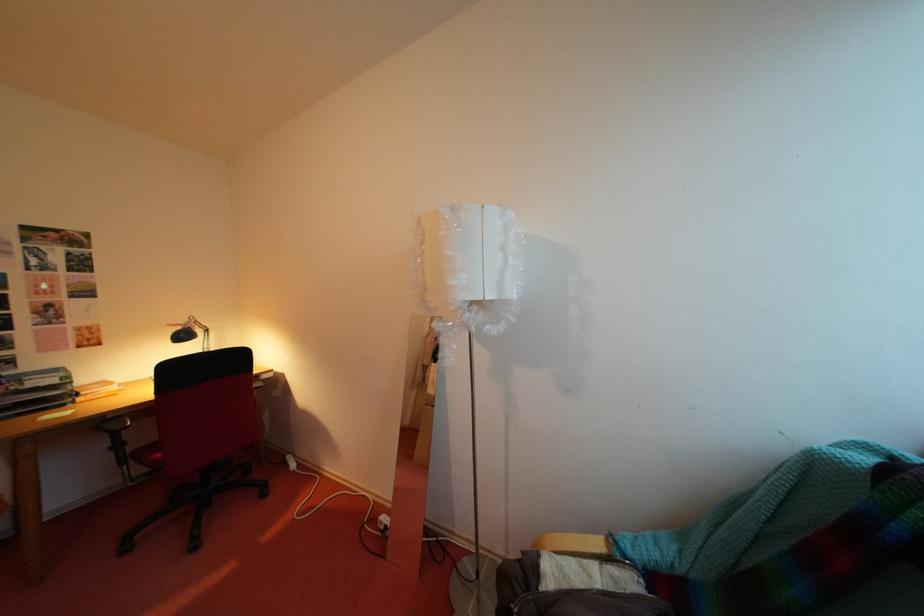
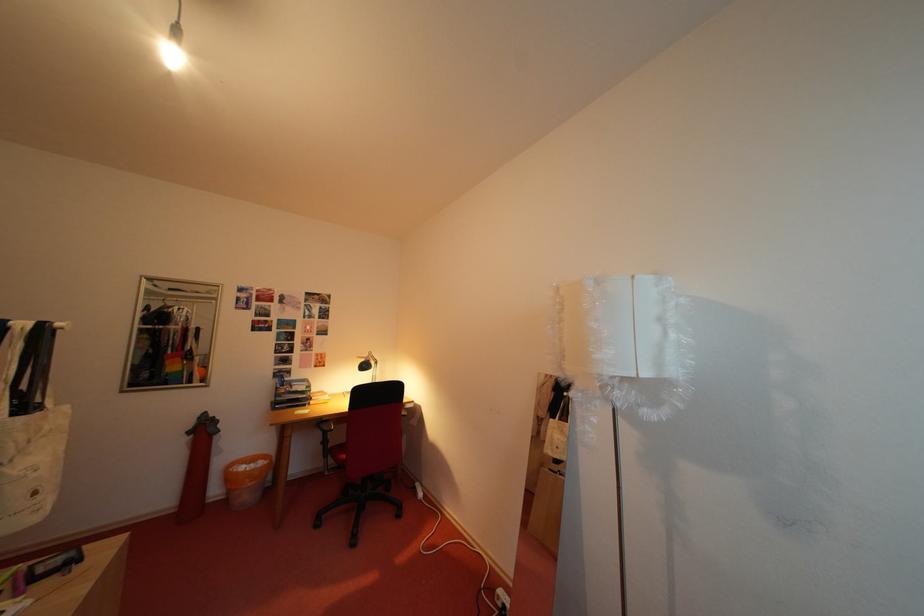
In the scene shown: The images are taken continuously from a first-person perspective. In which direction are you moving?

The cameraman walked toward left, backward.